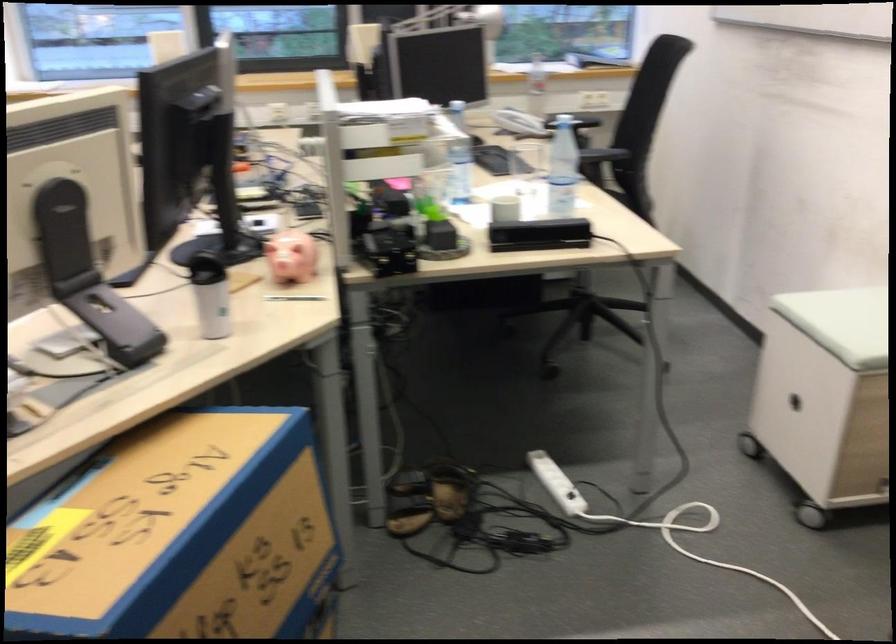
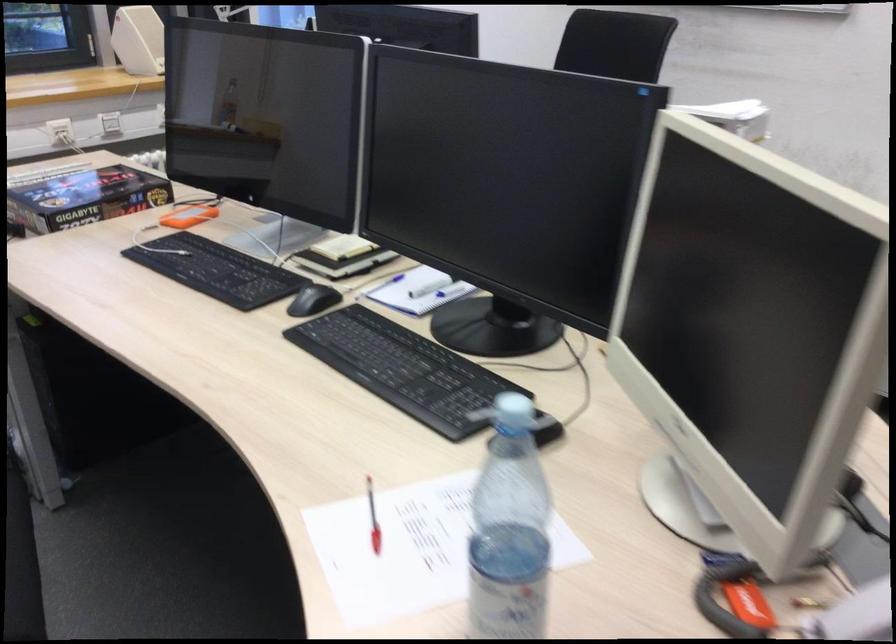
Question: I am providing you with two images of the same scene from different viewpoints. Please identify which objects are invisible in image2.

Choices:
 (A) spiral bound notebook
 (B) plastic water bottle
 (C) green tissue package
 (D) red and white pen

Answer: (B)